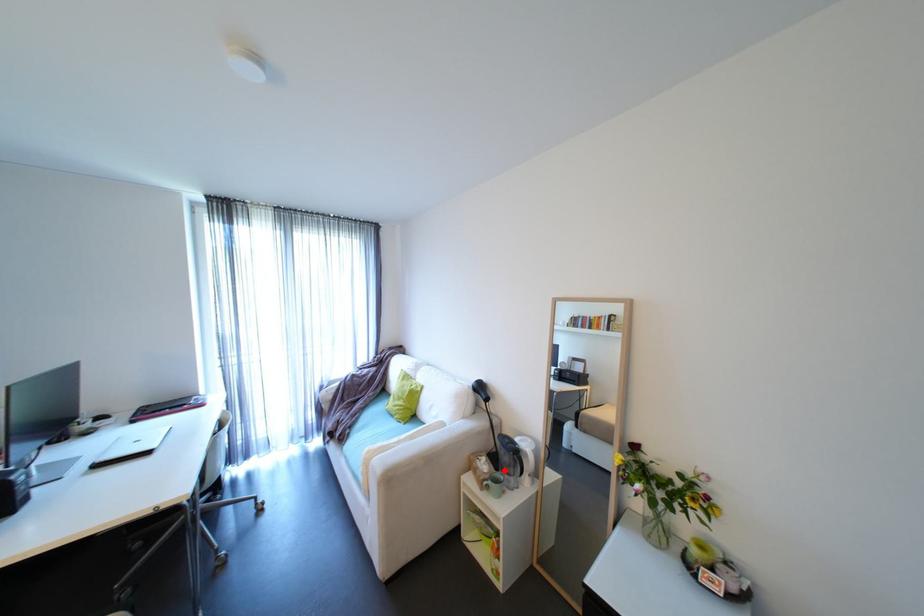
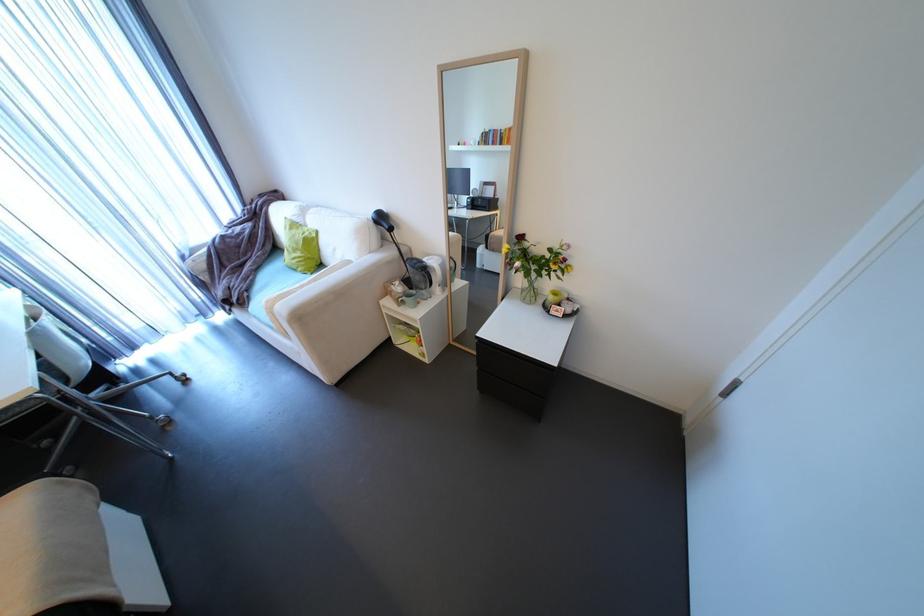
Find the pixel in the second image that matches the highlighted location in the first image.

(419, 289)